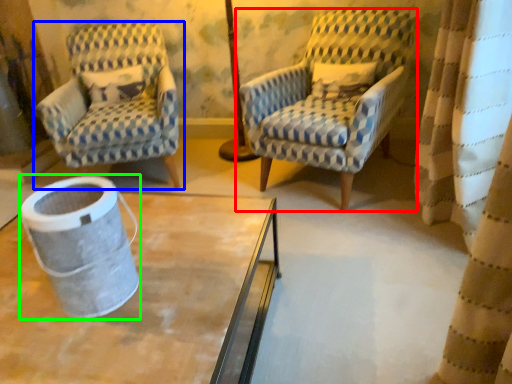
Question: Based on their relative distances, which object is farther from chair (highlighted by a red box)? Choose from chair (highlighted by a blue box) and gray (highlighted by a green box).

Choices:
 (A) chair
 (B) gray

Answer: (B)